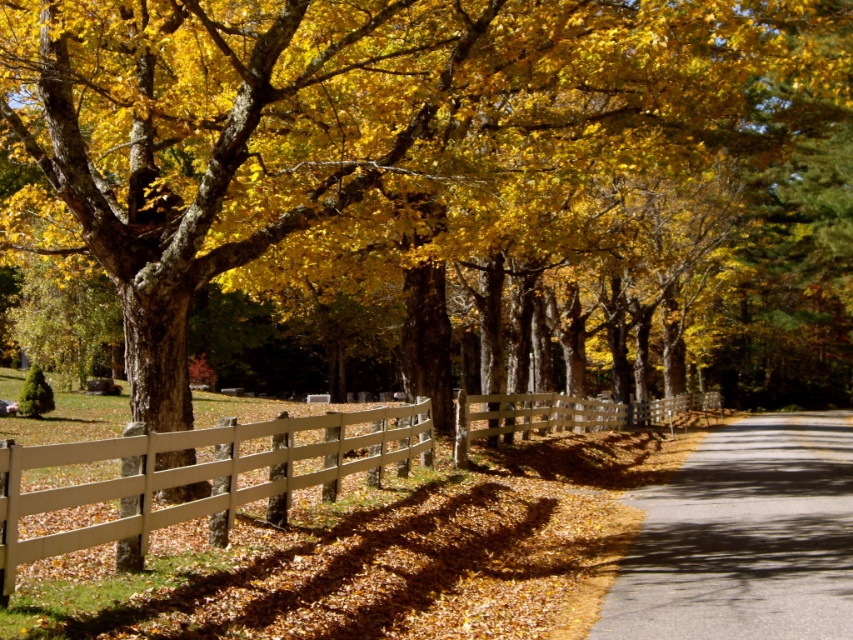
Does gray asphalt road at center appear over white wooden fence at center?

Incorrect, gray asphalt road at center is not positioned above white wooden fence at center.

Is gray asphalt road at center taller than white wooden fence at center?

In fact, gray asphalt road at center may be shorter than white wooden fence at center.

Does point (844, 440) come behind point (169, 444)?

Yes, point (844, 440) is behind point (169, 444).

Locate an element on the screen. gray asphalt road at center is located at coordinates (744, 538).